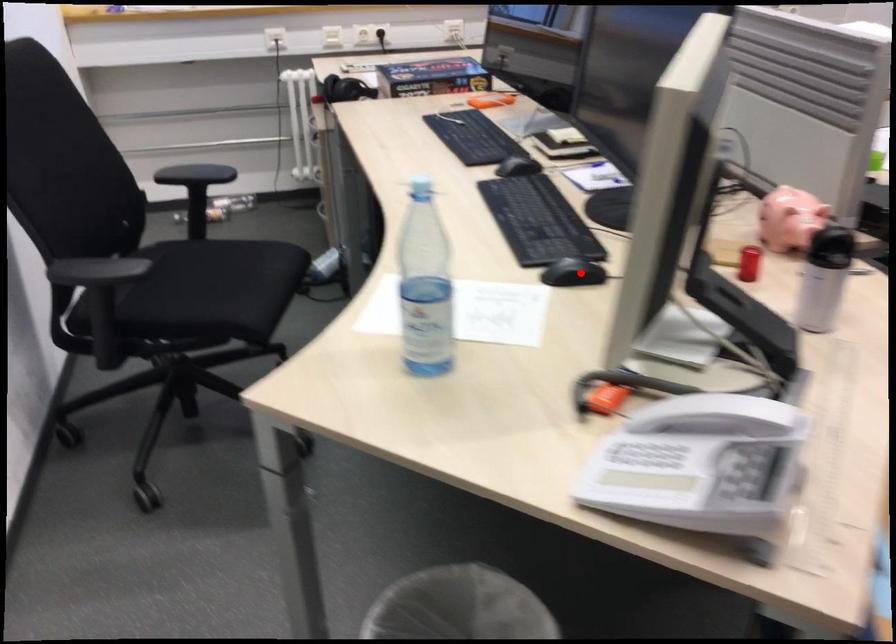
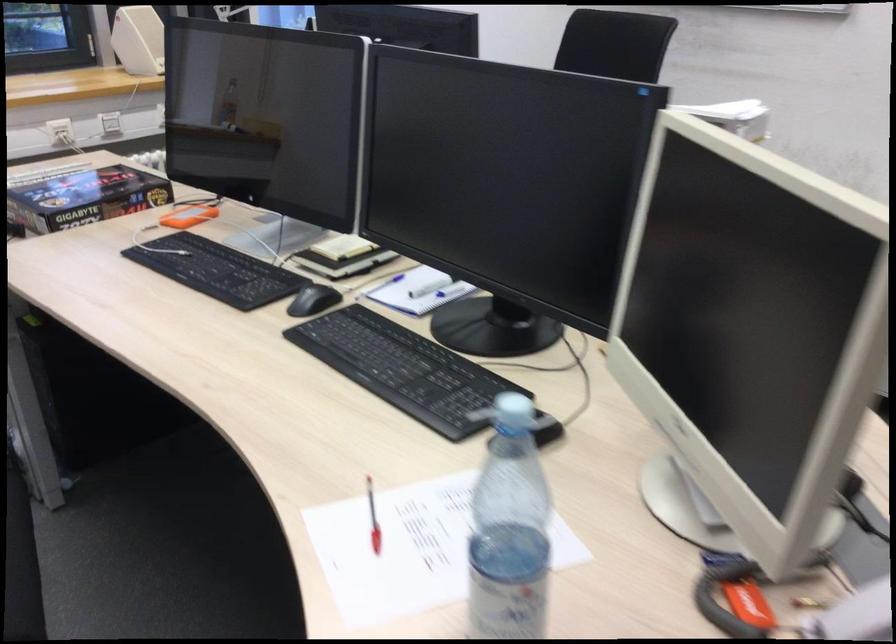
Question: I am providing you with two images of the same scene from different viewpoints. Image1 has a red point marked. In image2, the corresponding 3D location appears at what relative position? Reply with the corresponding letter.

Choices:
 (A) Closer
 (B) Farther

Answer: (A)